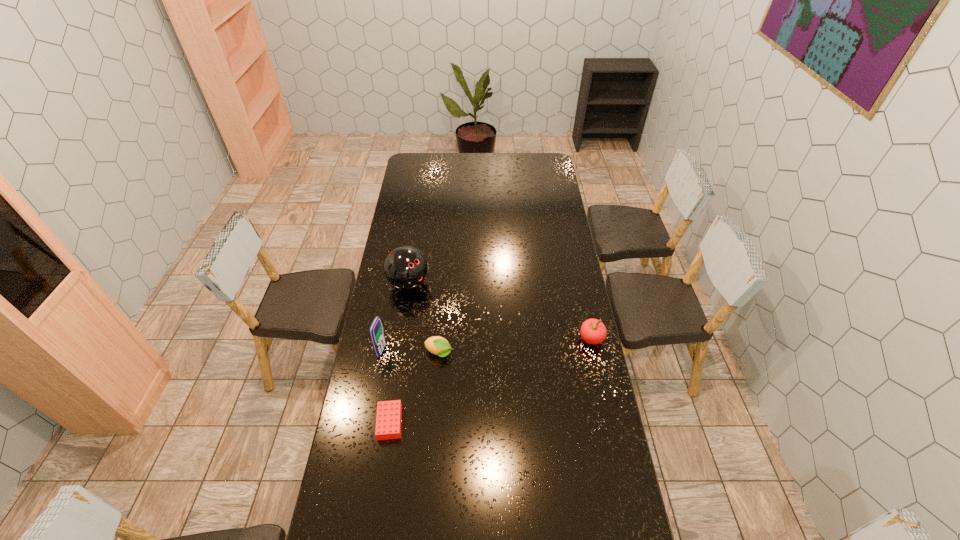
Where is `vacant spot on the desktop that is between the shortest object and the rightmost object and is positioned on the front-facing side of the cellular telephone`? This screenshot has width=960, height=540. vacant spot on the desktop that is between the shortest object and the rightmost object and is positioned on the front-facing side of the cellular telephone is located at coordinates (503, 375).

In order to click on vacant spot on the desktop that is between the nearest object and the rightmost object and is positioned on the surface of the farthest object near the finger holes in this screenshot , I will do `click(516, 370)`.

Where is `vacant spot on the desktop that is between the shortest object and the rightmost object and is positioned with leaves positioned above the second object from right to left`? vacant spot on the desktop that is between the shortest object and the rightmost object and is positioned with leaves positioned above the second object from right to left is located at coordinates (x=515, y=371).